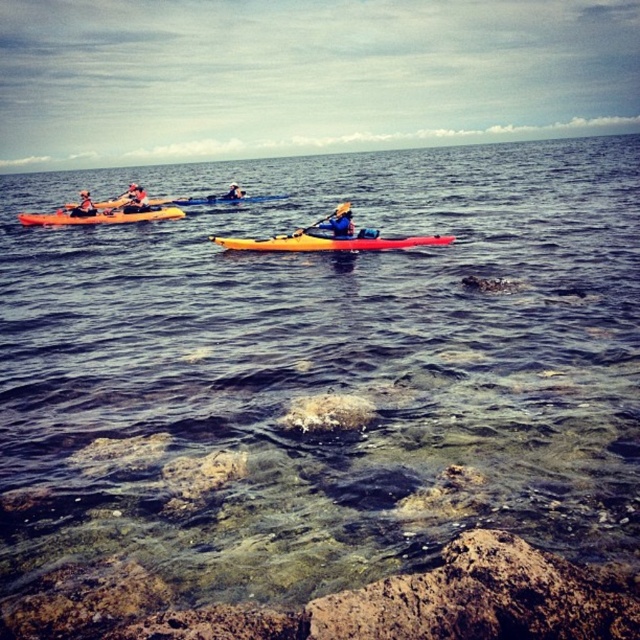
Is point (349, 445) closer to viewer compared to point (228, 189)?

Yes, it is in front of point (228, 189).

Which is in front, point (109, 429) or point (227, 198)?

Point (109, 429) is more forward.

What are the coordinates of `clear water at center` in the screenshot? It's located at (323, 371).

Is point (224, 237) behind point (83, 209)?

No, it is in front of (83, 209).

Can you confirm if orange matte kayak at center is thinner than matte black kayak at upper left?

Correct, orange matte kayak at center's width is less than matte black kayak at upper left's.

Is point (289, 248) closer to viewer compared to point (88, 193)?

Yes.

Locate an element on the screen. orange matte kayak at center is located at coordinates (326, 243).

Is clear water at center positioned in front of matte yellow kayak at center?

Yes, clear water at center is in front of matte yellow kayak at center.

Does point (196, 252) lie in front of point (323, 225)?

No.

The width and height of the screenshot is (640, 640). Identify the location of clear water at center. (323, 371).

Image resolution: width=640 pixels, height=640 pixels. Find the location of `clear water at center`. clear water at center is located at coordinates (323, 371).